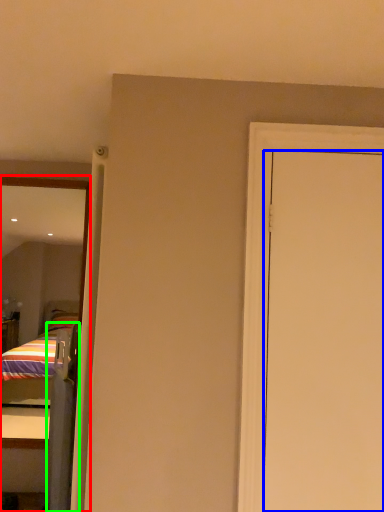
Question: Estimate the real-world distances between objects in this image. Which object is closer to mirror (highlighted by a red box), door (highlighted by a blue box) or screen door (highlighted by a green box)?

Choices:
 (A) door
 (B) screen door

Answer: (B)